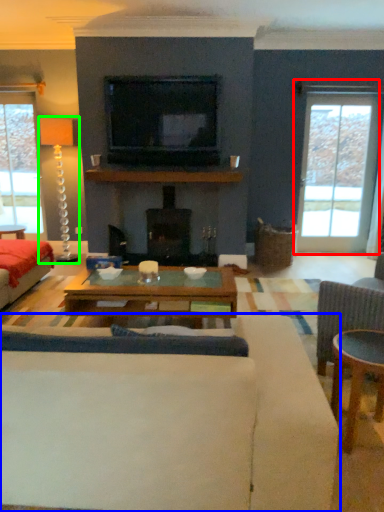
Question: Considering the real-world distances, which object is closest to window (highlighted by a red box)? studio couch (highlighted by a blue box) or lamp (highlighted by a green box).

Choices:
 (A) studio couch
 (B) lamp

Answer: (B)